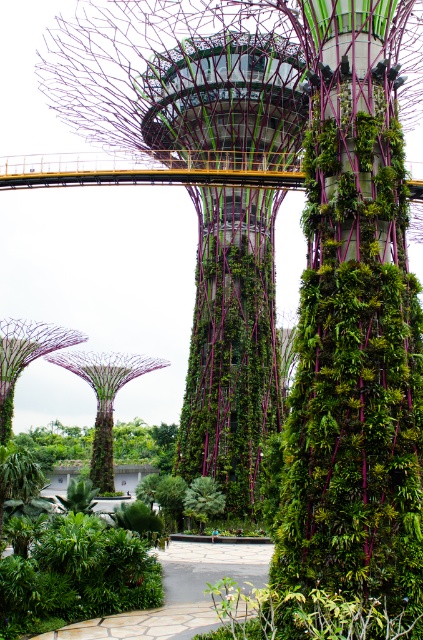
You are standing at the entrance of the botanical garden and want to locate the green textured tower at center. According to the map, your current position is at coordinates point A. Where should you move to find the tower?

The green textured tower at center is located at point [231,342], so you should move towards that coordinate to find the tower.

You are standing in the botanical garden and see the green textured tower at center and the green leafy tree at center. Which object is positioned to the right side?

The green textured tower at center is to the right of the green leafy tree at center.